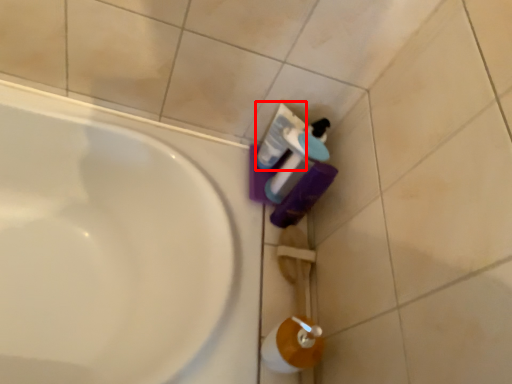
Question: From the image's perspective, where is mouthwash (annotated by the red box) located in relation to cleaning product in the image?

Choices:
 (A) below
 (B) above

Answer: (B)